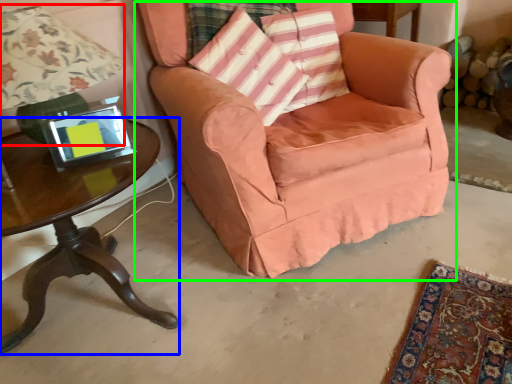
Question: Based on their relative distances, which object is farther from lamp (highlighted by a red box)? Choose from table (highlighted by a blue box) and chair (highlighted by a green box).

Choices:
 (A) table
 (B) chair

Answer: (B)